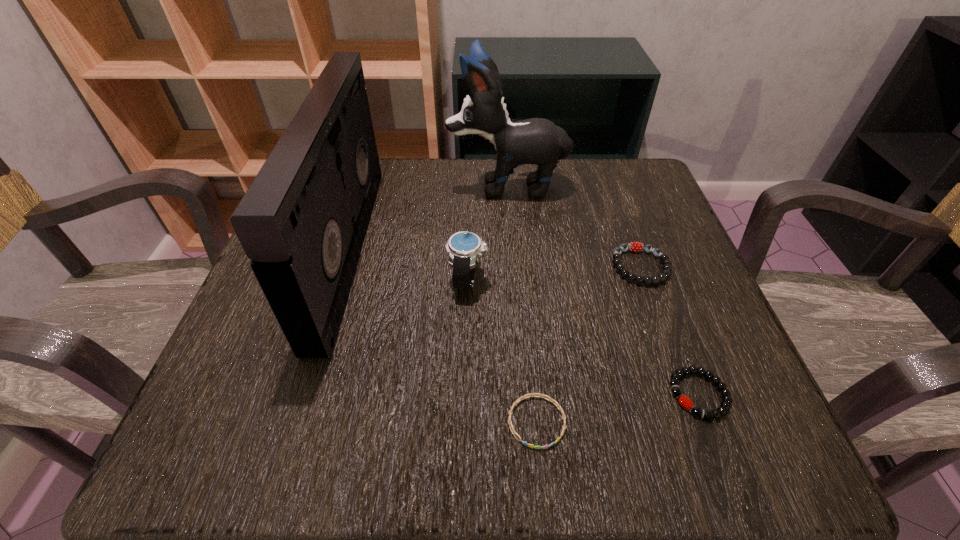
Locate an element on the screen. The image size is (960, 540). free space at the far edge is located at coordinates (464, 198).

In the image, there is a desktop. Identify the location of vacant space at the near edge. This screenshot has width=960, height=540. (538, 441).

Locate an element on the screen. vacant area at the left edge is located at coordinates (211, 381).

Image resolution: width=960 pixels, height=540 pixels. Find the location of `vacant space at the right edge of the desktop`. vacant space at the right edge of the desktop is located at coordinates (657, 221).

In the image, there is a desktop. Where is `free space at the far right corner`? free space at the far right corner is located at coordinates (633, 217).

You are a GUI agent. You are given a task and a screenshot of the screen. Output one action in this format:
    pyautogui.click(x=<x>, y=<y>)
    Task: Click on the unoccupied position between the videotape and the watch
    The image size is (960, 540).
    Given the screenshot: What is the action you would take?
    pyautogui.click(x=408, y=265)

This screenshot has width=960, height=540. I want to click on empty location between the second tallest bracelet and the farthest bracelet, so click(670, 330).

Where is `vacant area that lies between the puppy and the second shortest bracelet`? vacant area that lies between the puppy and the second shortest bracelet is located at coordinates (603, 290).

Find the location of a particular element. This screenshot has width=960, height=540. empty space between the farthest bracelet and the shortest bracelet is located at coordinates 588,344.

At what (x,y) coordinates should I click in order to perform the action: click on vacant space in between the farthest bracelet and the videotape. Please return your answer as a coordinate pair (x, y). The image size is (960, 540). Looking at the image, I should click on (494, 258).